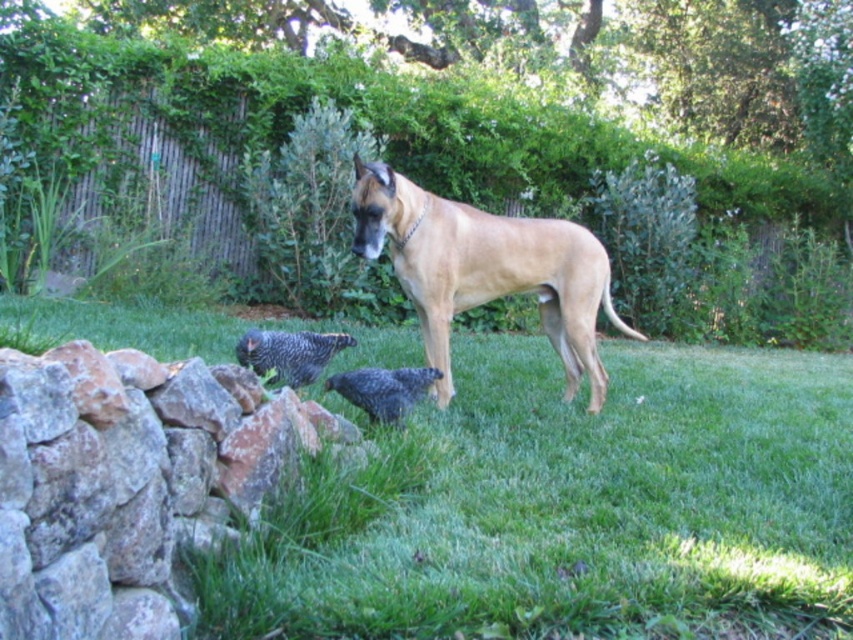
Question: Is green grass at lower center above golden tan fur at center?

Choices:
 (A) no
 (B) yes

Answer: (A)

Question: Which point is closer to the camera?

Choices:
 (A) (375, 486)
 (B) (592, 276)

Answer: (A)

Question: Does rustic stone wall at lower left appear over golden tan fur at center?

Choices:
 (A) yes
 (B) no

Answer: (B)

Question: Which object is positioned farthest from the green grass at lower center?

Choices:
 (A) golden tan fur at center
 (B) rustic stone wall at lower left

Answer: (B)

Question: Does green grass at lower center have a smaller size compared to rustic stone wall at lower left?

Choices:
 (A) yes
 (B) no

Answer: (B)

Question: Which object is farther from the camera taking this photo?

Choices:
 (A) green grass at lower center
 (B) rustic stone wall at lower left

Answer: (A)